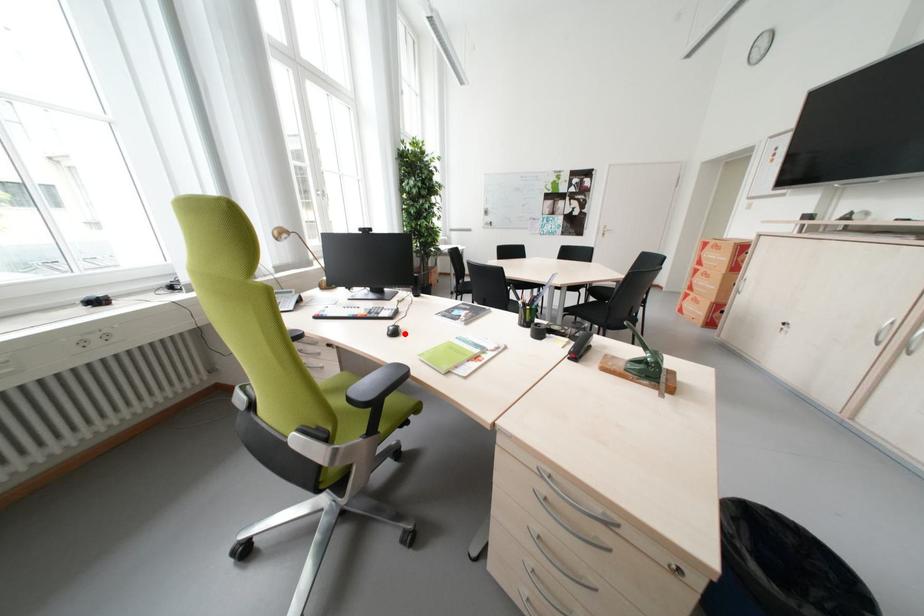
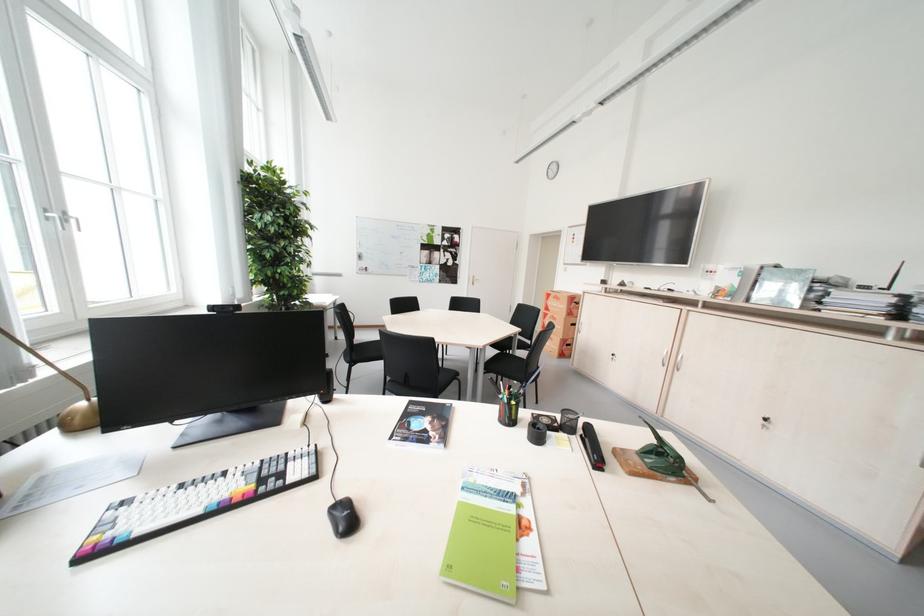
The point at the highlighted location is marked in the first image. Where is the corresponding point in the second image?

(359, 521)